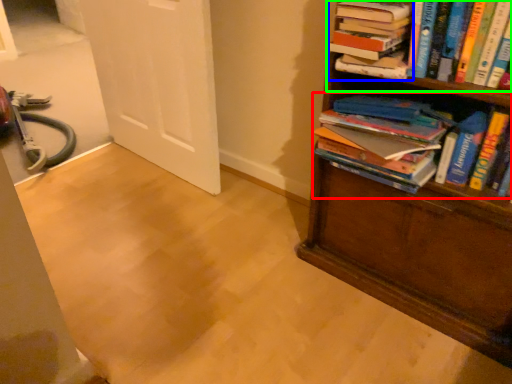
Question: Considering the real-world distances, which object is closest to book (highlighted by a red box)? book (highlighted by a blue box) or book (highlighted by a green box).

Choices:
 (A) book
 (B) book

Answer: (B)